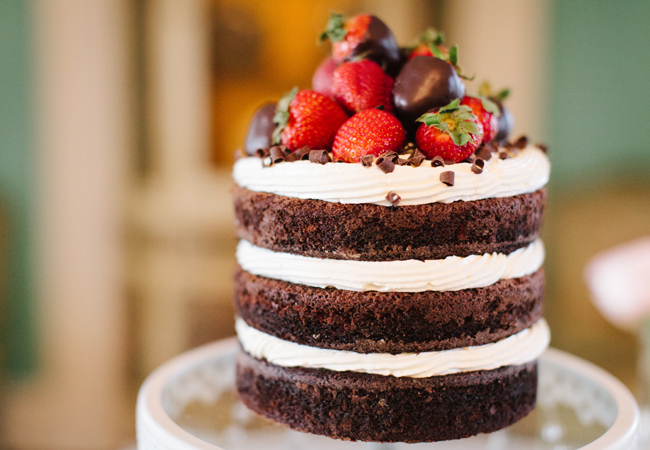
The width and height of the screenshot is (650, 450). In order to click on dish in this screenshot , I will do `click(567, 417)`.